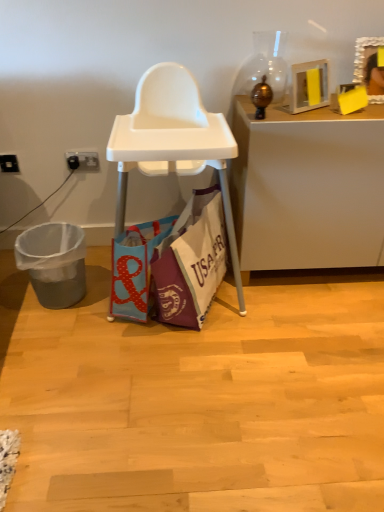
In order to face black plastic power outlet at lower left, the 2th power outlet in the right-to-left sequence, should I rotate leftwards or rightwards?

It's best to rotate left around 22.972 degrees.

Find the location of a particular element. Image resolution: width=384 pixels, height=512 pixels. white glossy desk at upper right is located at coordinates (307, 188).

In the scene shown: Measure the distance between white plastic high chair at center and camera.

They are 4.62 feet apart.

You are a GUI agent. You are given a task and a screenshot of the screen. Output one action in this format:
    pyautogui.click(x=<x>, y=<y>)
    Task: Click on the white plastic high chair at center
    The height and width of the screenshot is (512, 384).
    Given the screenshot: What is the action you would take?
    pyautogui.click(x=173, y=142)

Image resolution: width=384 pixels, height=512 pixels. I want to click on purple fabric bag at center, which is counted as the 1th handbag, starting from the right, so click(191, 261).

Is white plastic power outlet at lower left, which is counted as the first power outlet, starting from the right, oriented away from blue fabric bag at center, which is counted as the 2th handbag, starting from the right?

No, white plastic power outlet at lower left, which is counted as the first power outlet, starting from the right, is not facing away from blue fabric bag at center, which is counted as the 2th handbag, starting from the right.

In the image, is white plastic power outlet at lower left, which is counted as the first power outlet, starting from the right, positioned in front of or behind blue fabric bag at center, which is counted as the 2th handbag, starting from the right?

Clearly, white plastic power outlet at lower left, which is counted as the first power outlet, starting from the right, is behind blue fabric bag at center, which is counted as the 2th handbag, starting from the right.

In the scene shown: In the image, is white plastic power outlet at lower left, the second power outlet when ordered from left to right, on the left side or the right side of blue fabric bag at center, which is the first handbag from left to right?

In the image, white plastic power outlet at lower left, the second power outlet when ordered from left to right, appears on the left side of blue fabric bag at center, which is the first handbag from left to right.

How many degrees apart are the facing directions of white plastic power outlet at lower left, which is counted as the first power outlet, starting from the right, and blue fabric bag at center, which is the first handbag from left to right?

14.4 degrees separate the facing orientations of white plastic power outlet at lower left, which is counted as the first power outlet, starting from the right, and blue fabric bag at center, which is the first handbag from left to right.

Is wooden picture frame at upper right at the back of black plastic power outlet at lower left, the 2th power outlet in the right-to-left sequence?

That's not correct — black plastic power outlet at lower left, the 2th power outlet in the right-to-left sequence, is not looking away from wooden picture frame at upper right.

From a real-world perspective, which is physically below, black plastic power outlet at lower left, the 2th power outlet in the right-to-left sequence, or wooden picture frame at upper right?

black plastic power outlet at lower left, the 2th power outlet in the right-to-left sequence, is physically lower.

Is there a large distance between black plastic power outlet at lower left, the 2th power outlet in the right-to-left sequence, and wooden picture frame at upper right?

Yes, black plastic power outlet at lower left, the 2th power outlet in the right-to-left sequence, and wooden picture frame at upper right are located far from each other.

From the wooden picture frame at upper right, count the 2nd power outlet to the left and point to it. Please provide its 2D coordinates.

[(9, 163)]

From the image's perspective, does white plastic power outlet at lower left, the second power outlet when ordered from left to right, appear lower than white plastic high chair at center?

No.

From a real-world perspective, is white plastic power outlet at lower left, which is counted as the first power outlet, starting from the right, physically located above or below white plastic high chair at center?

white plastic power outlet at lower left, which is counted as the first power outlet, starting from the right, is above white plastic high chair at center.

From the picture: Between gray plastic trash can at lower left and wooden picture frame at upper right, which one appears on the right side from the viewer's perspective?

wooden picture frame at upper right.

In the scene shown: Considering their positions, is gray plastic trash can at lower left located in front of or behind wooden picture frame at upper right?

Visually, gray plastic trash can at lower left is located behind wooden picture frame at upper right.

Where is `picture frame that appears on the right of gray plastic trash can at lower left`? Image resolution: width=384 pixels, height=512 pixels. picture frame that appears on the right of gray plastic trash can at lower left is located at coordinates click(x=368, y=66).

Looking at this image, considering the sizes of objects gray plastic trash can at lower left and wooden picture frame at upper right in the image provided, who is taller, gray plastic trash can at lower left or wooden picture frame at upper right?

gray plastic trash can at lower left is taller.

Looking at this image, from their relative heights in the image, would you say black plastic power outlet at lower left, the 2th power outlet in the right-to-left sequence, is taller or shorter than white glossy desk at upper right?

Clearly, black plastic power outlet at lower left, the 2th power outlet in the right-to-left sequence, is shorter compared to white glossy desk at upper right.

In the scene shown: From a real-world perspective, is black plastic power outlet at lower left, the 2th power outlet in the right-to-left sequence, positioned above or below white glossy desk at upper right?

Clearly, from a real-world perspective, black plastic power outlet at lower left, the 2th power outlet in the right-to-left sequence, is above white glossy desk at upper right.

From the picture: Is black plastic power outlet at lower left, the 2th power outlet in the right-to-left sequence, outside of white glossy desk at upper right?

Indeed, black plastic power outlet at lower left, the 2th power outlet in the right-to-left sequence, is completely outside white glossy desk at upper right.

From the image's perspective, is black plastic power outlet at lower left, arranged as the first power outlet when viewed from the left, above or below white glossy desk at upper right?

Clearly, from the image's perspective, black plastic power outlet at lower left, arranged as the first power outlet when viewed from the left, is above white glossy desk at upper right.

Is point (8, 172) positioned in front of point (20, 242)?

No, it is behind (20, 242).

Consider the image. Is black plastic power outlet at lower left, the 2th power outlet in the right-to-left sequence, facing towards gray plastic trash can at lower left?

No.

Can you tell me how much black plastic power outlet at lower left, arranged as the first power outlet when viewed from the left, and gray plastic trash can at lower left differ in facing direction?

black plastic power outlet at lower left, arranged as the first power outlet when viewed from the left, and gray plastic trash can at lower left are facing 0.473 degrees away from each other.

Between black plastic power outlet at lower left, arranged as the first power outlet when viewed from the left, and gray plastic trash can at lower left, which one has smaller width?

black plastic power outlet at lower left, arranged as the first power outlet when viewed from the left.

Is wooden picture frame at upper right shorter than gray plastic trash can at lower left?

Indeed, wooden picture frame at upper right has a lesser height compared to gray plastic trash can at lower left.

From the picture: Measure the distance between wooden picture frame at upper right and gray plastic trash can at lower left.

wooden picture frame at upper right is 4.50 feet from gray plastic trash can at lower left.

Does wooden picture frame at upper right turn towards gray plastic trash can at lower left?

No, wooden picture frame at upper right is not aimed at gray plastic trash can at lower left.

From a real-world perspective, is wooden picture frame at upper right physically located above or below gray plastic trash can at lower left?

Clearly, from a real-world perspective, wooden picture frame at upper right is above gray plastic trash can at lower left.

Which power outlet is the 1st one when counting from the left side of the blue fabric bag at center, which is the first handbag from left to right? Please provide its 2D coordinates.

[(83, 161)]

Where is `the 1st power outlet behind the wooden picture frame at upper right`? the 1st power outlet behind the wooden picture frame at upper right is located at coordinates (9, 163).

Considering their positions, is blue fabric bag at center, which is counted as the 2th handbag, starting from the right, positioned further to white plastic power outlet at lower left, which is counted as the first power outlet, starting from the right, than white glossy desk at upper right?

white glossy desk at upper right lies further to white plastic power outlet at lower left, which is counted as the first power outlet, starting from the right, than the other object.

Based on their spatial positions, is white glossy desk at upper right or wooden picture frame at upper right closer to gray plastic trash can at lower left?

white glossy desk at upper right is closer to gray plastic trash can at lower left.

Based on their spatial positions, is white glossy desk at upper right or purple fabric bag at center, which is the second handbag from left to right, further from white plastic power outlet at lower left, which is counted as the first power outlet, starting from the right?

white glossy desk at upper right is further to white plastic power outlet at lower left, which is counted as the first power outlet, starting from the right.

Which object lies further to the anchor point gray plastic trash can at lower left, blue fabric bag at center, which is counted as the 2th handbag, starting from the right, or black plastic power outlet at lower left, arranged as the first power outlet when viewed from the left?

black plastic power outlet at lower left, arranged as the first power outlet when viewed from the left.

Which object lies further to the anchor point black plastic power outlet at lower left, the 2th power outlet in the right-to-left sequence, white glossy desk at upper right or wooden picture frame at upper right?

wooden picture frame at upper right is further to black plastic power outlet at lower left, the 2th power outlet in the right-to-left sequence.

When comparing their distances from blue fabric bag at center, which is the first handbag from left to right, does wooden picture frame at upper right or white glossy desk at upper right seem further?

wooden picture frame at upper right lies further to blue fabric bag at center, which is the first handbag from left to right, than the other object.

Looking at this image, estimate the real-world distances between objects in this image. Which object is further from white plastic high chair at center, blue fabric bag at center, which is the first handbag from left to right, or purple fabric bag at center, which is the second handbag from left to right?

The object further to white plastic high chair at center is blue fabric bag at center, which is the first handbag from left to right.

Based on their spatial positions, is gray plastic trash can at lower left or blue fabric bag at center, which is counted as the 2th handbag, starting from the right, closer to black plastic power outlet at lower left, the 2th power outlet in the right-to-left sequence?

gray plastic trash can at lower left is positioned closer to the anchor black plastic power outlet at lower left, the 2th power outlet in the right-to-left sequence.

You are a GUI agent. You are given a task and a screenshot of the screen. Output one action in this format:
    pyautogui.click(x=<x>, y=<y>)
    Task: Click on the power outlet between white plastic power outlet at lower left, which is counted as the first power outlet, starting from the right, and gray plastic trash can at lower left vertically
    
    Given the screenshot: What is the action you would take?
    (9, 163)

The width and height of the screenshot is (384, 512). What are the coordinates of `armchair located between gray plastic trash can at lower left and white glossy desk at upper right in the left-right direction` in the screenshot? It's located at (173, 142).

You are a GUI agent. You are given a task and a screenshot of the screen. Output one action in this format:
    pyautogui.click(x=<x>, y=<y>)
    Task: Click on the handbag between gray plastic trash can at lower left and white plastic high chair at center
    The width and height of the screenshot is (384, 512).
    Given the screenshot: What is the action you would take?
    pyautogui.click(x=135, y=267)

The width and height of the screenshot is (384, 512). Find the location of `trash bin/can between white plastic high chair at center and white plastic power outlet at lower left, the second power outlet when ordered from left to right, from front to back`. trash bin/can between white plastic high chair at center and white plastic power outlet at lower left, the second power outlet when ordered from left to right, from front to back is located at coordinates (54, 262).